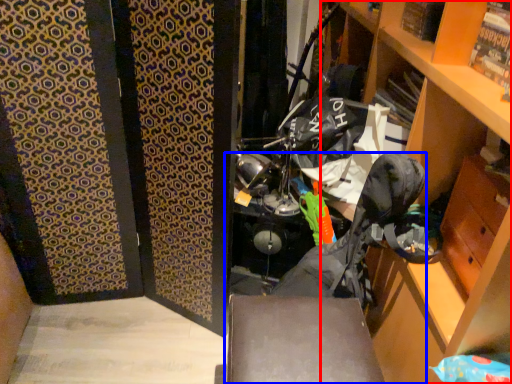
Question: Which of the following is the closest to the observer, cabinetry (highlighted by a red box) or folding chair (highlighted by a blue box)?

Choices:
 (A) cabinetry
 (B) folding chair

Answer: (A)